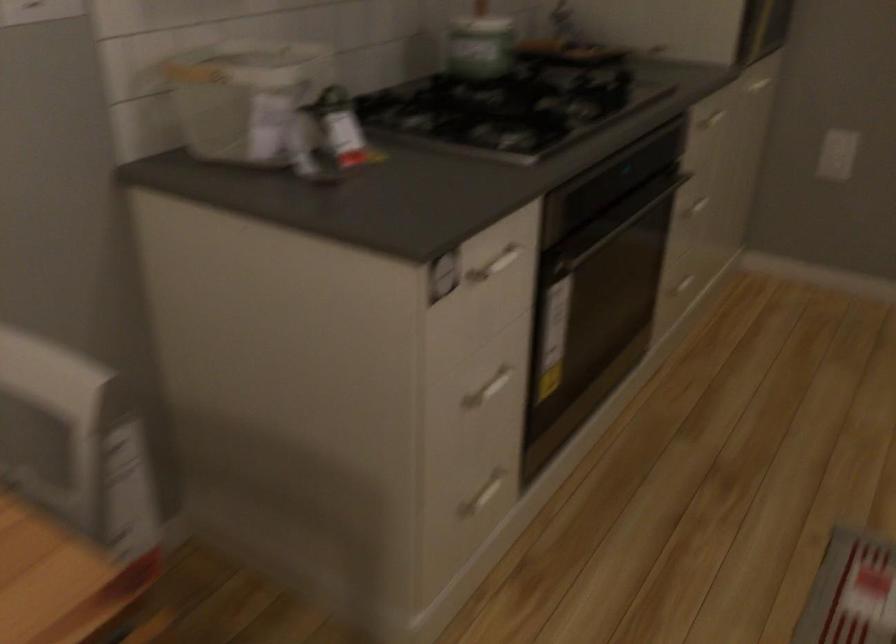
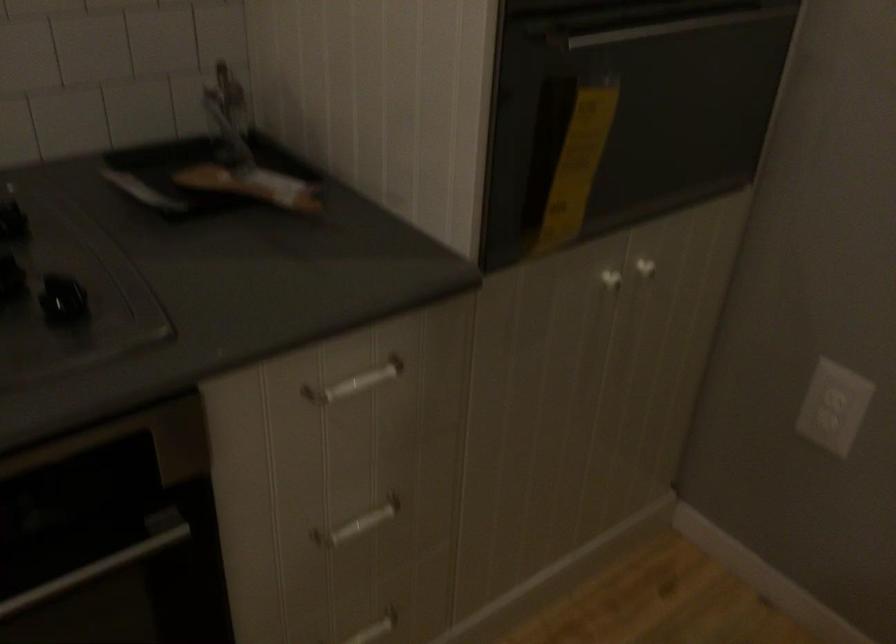
Locate, in the second image, the point that corresponds to (x=709, y=118) in the first image.

(355, 383)